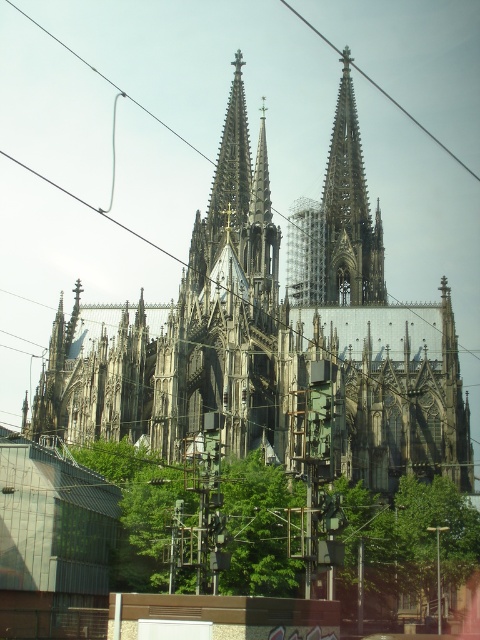
You are a drone operator trying to capture a photo of the dark gray stone church at center. Your drone is currently at point A located at coordinates 0.3, 0.6. To get the best shot, you need to adjust your drone to the exact coordinates of the church. What direction should you move your drone to reach the church?

The dark gray stone church at center is located at coordinates (272, 336). Since your drone is at (288, 192), you should move it northeast to reach the church.

You are a photographer planning to take a photo of the dark gray stone church at center and the metallic wire at upper center. From your current position, which object will appear closer to you in the photo?

The dark gray stone church at center will appear closer to you in the photo because it is in front of the metallic wire at upper center.

You are an urban planner assessing the cathedral and the wires for a city renovation project. The city wants to know if the dark gray stone church at center and the metallic wire at upper center can be seen side by side without overlapping. Based on their sizes, what do you conclude?

The dark gray stone church at center is wider than the metallic wire at upper center, so they can be seen side by side without overlapping as the church is wider.